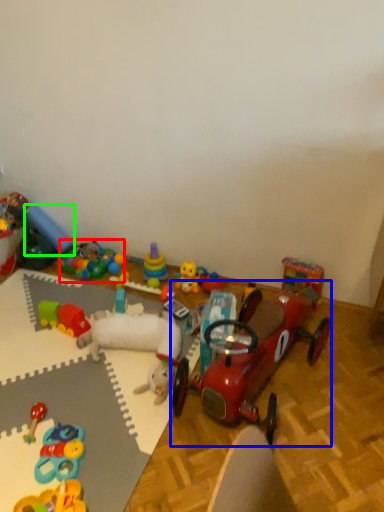
Question: Considering the real-world distances, which object is closest to toy (highlighted by a red box)? toy (highlighted by a blue box) or toy (highlighted by a green box).

Choices:
 (A) toy
 (B) toy

Answer: (B)